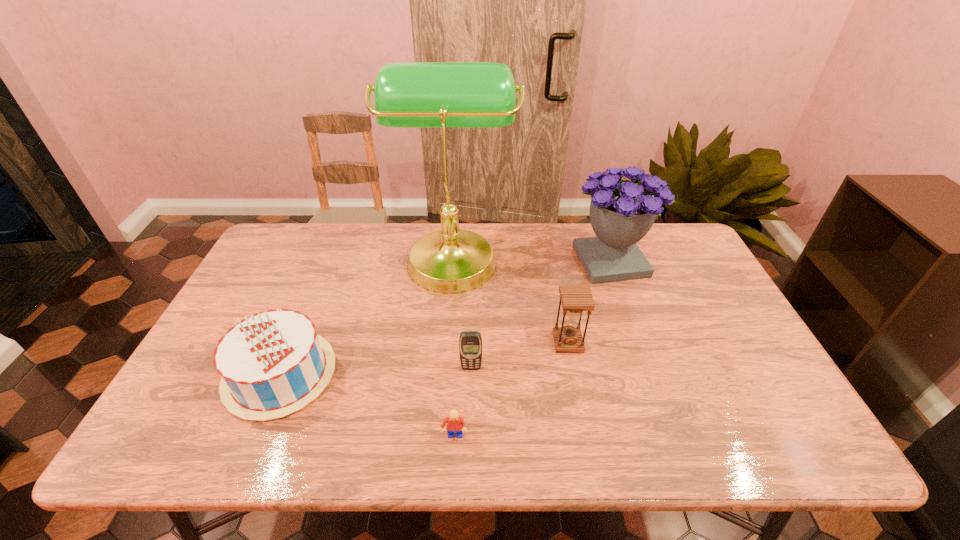
This screenshot has width=960, height=540. What are the coordinates of `vacant space located 0.350m on the right of the hourglass` in the screenshot? It's located at (713, 342).

The width and height of the screenshot is (960, 540). I want to click on free location located on the back of the leftmost object, so click(324, 269).

Where is `vacant space located on the screen of the cellular telephone`? The height and width of the screenshot is (540, 960). vacant space located on the screen of the cellular telephone is located at coordinates (470, 413).

Image resolution: width=960 pixels, height=540 pixels. What are the coordinates of `lamp at the far edge` in the screenshot? It's located at (406, 94).

Identify the location of bouquet that is at the far edge. This screenshot has height=540, width=960. (622, 212).

Where is `birthday cake that is at the near edge`? The height and width of the screenshot is (540, 960). birthday cake that is at the near edge is located at coordinates (272, 364).

Locate an element on the screen. Lego situated at the near edge is located at coordinates (455, 423).

Where is `object that is at the left edge`? The image size is (960, 540). object that is at the left edge is located at coordinates (272, 364).

The height and width of the screenshot is (540, 960). I want to click on object that is positioned at the near left corner, so click(x=272, y=364).

In the image, there is a desktop. Where is `free space at the far edge`? The image size is (960, 540). free space at the far edge is located at coordinates (379, 222).